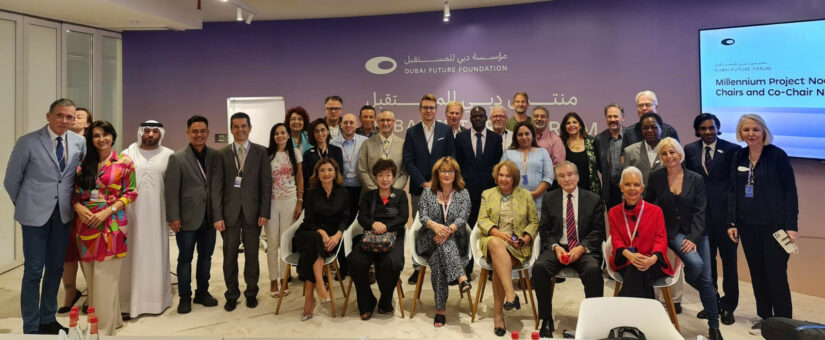
This screenshot has width=825, height=340. In order to click on projector screen in this screenshot , I will do `click(788, 52)`.